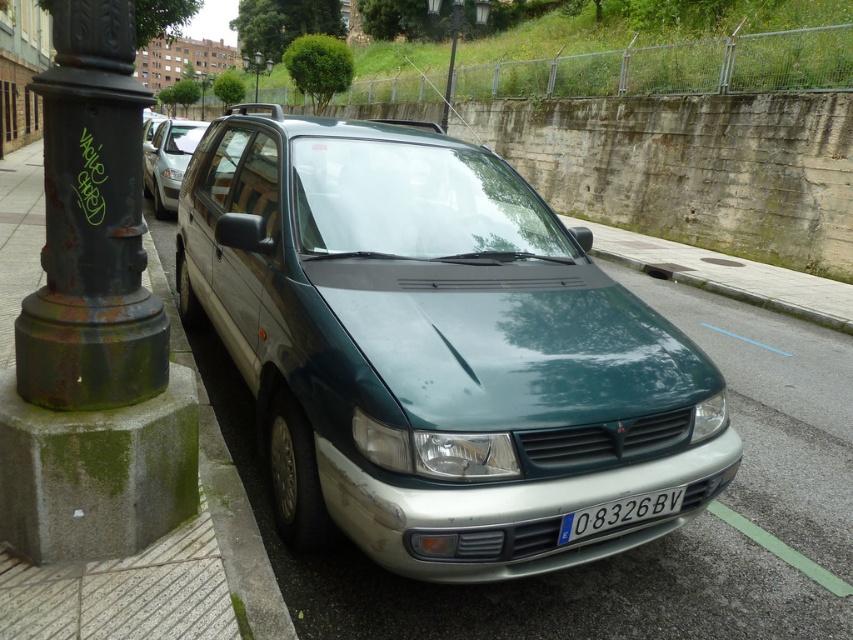
Question: Which of the following is the farthest from the observer?

Choices:
 (A) green matte van at center
 (B) white plastic license plate at center
 (C) rusty metal pole at upper left
 (D) green matte car at center

Answer: (C)

Question: Can you confirm if rusty metal pole at left is smaller than rusty metal pole at upper left?

Choices:
 (A) no
 (B) yes

Answer: (B)

Question: Does green matte car at center appear over white plastic license plate at center?

Choices:
 (A) no
 (B) yes

Answer: (B)

Question: Among these points, which one is farthest from the camera?

Choices:
 (A) (184, 145)
 (B) (210, 84)
 (C) (625, 502)

Answer: (B)

Question: Is rusty metal pole at left to the left of white plastic license plate at center from the viewer's perspective?

Choices:
 (A) no
 (B) yes

Answer: (B)

Question: Which object is the closest to the white plastic license plate at center?

Choices:
 (A) green matte car at center
 (B) green mossy concrete at left

Answer: (B)